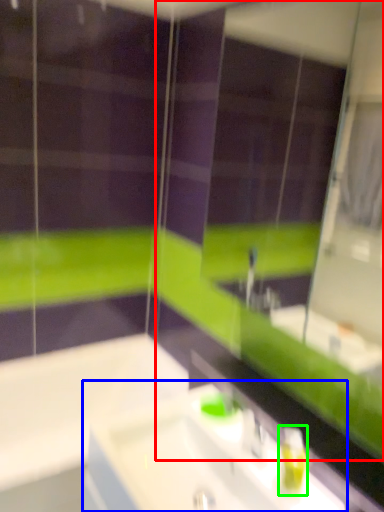
Question: Based on their relative distances, which object is farther from mirror (highlighted by a red box)? Choose from sink (highlighted by a blue box) and soap dispenser (highlighted by a green box).

Choices:
 (A) sink
 (B) soap dispenser

Answer: (B)